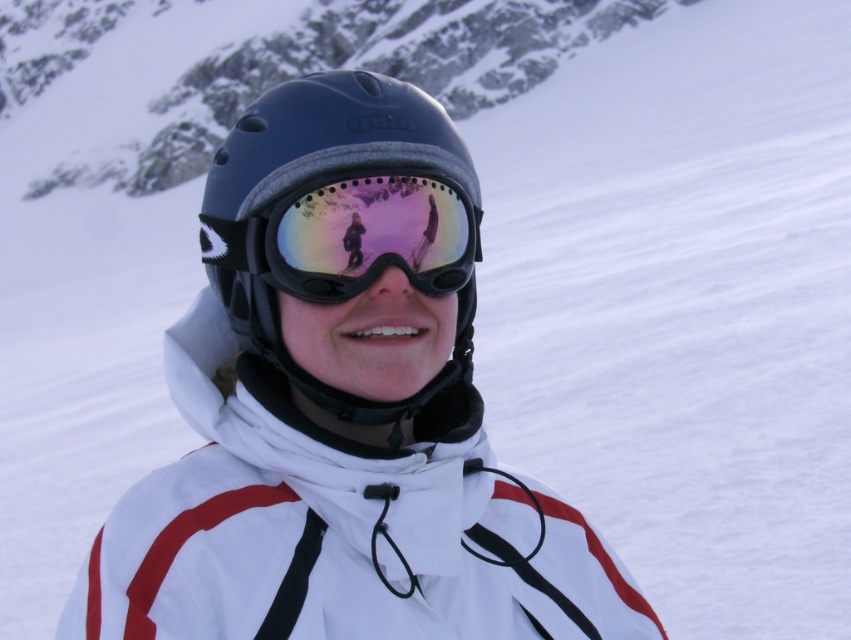
Question: Is matte black helmet at center closer to camera compared to reflective plastic goggles at center?

Choices:
 (A) no
 (B) yes

Answer: (A)

Question: Among these objects, which one is farthest from the camera?

Choices:
 (A) matte black helmet at center
 (B) reflective plastic goggles at center

Answer: (A)

Question: Can you confirm if matte black helmet at center is positioned to the left of reflective plastic goggles at center?

Choices:
 (A) no
 (B) yes

Answer: (B)

Question: Which object appears farthest from the camera in this image?

Choices:
 (A) matte black helmet at center
 (B) reflective plastic goggles at center

Answer: (A)

Question: Is matte black helmet at center positioned before reflective plastic goggles at center?

Choices:
 (A) yes
 (B) no

Answer: (B)